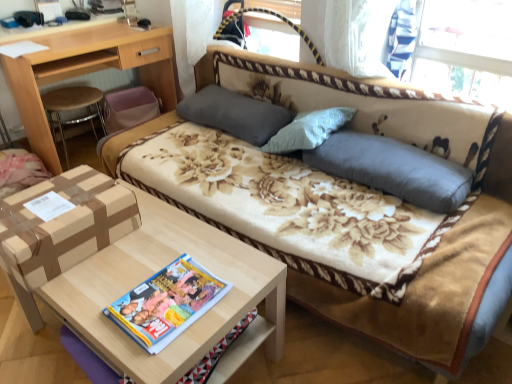
Image resolution: width=512 pixels, height=384 pixels. What are the coordinates of `vacant area that lies to the right of brown cardboard box at lower left` in the screenshot? It's located at (158, 243).